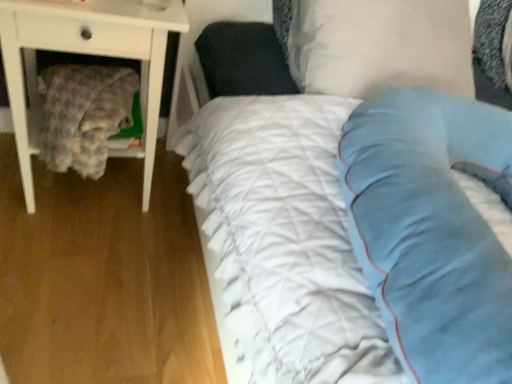
Question: Is fluffy fabric blanket at left completely or partially inside white quilted fabric at center?

Choices:
 (A) no
 (B) yes

Answer: (A)

Question: From the image's perspective, is white quilted fabric at center on top of fluffy fabric blanket at left?

Choices:
 (A) yes
 (B) no

Answer: (B)

Question: Is white quilted fabric at center aimed at fluffy fabric blanket at left?

Choices:
 (A) yes
 (B) no

Answer: (B)

Question: Considering the relative sizes of white quilted fabric at center and fluffy fabric blanket at left in the image provided, is white quilted fabric at center wider than fluffy fabric blanket at left?

Choices:
 (A) no
 (B) yes

Answer: (B)

Question: Can you confirm if white quilted fabric at center is taller than fluffy fabric blanket at left?

Choices:
 (A) yes
 (B) no

Answer: (B)

Question: Can you confirm if white quilted fabric at center is bigger than fluffy fabric blanket at left?

Choices:
 (A) yes
 (B) no

Answer: (A)

Question: Does white wood nightstand at left have a smaller size compared to white soft pillow at upper center?

Choices:
 (A) no
 (B) yes

Answer: (A)

Question: Can you confirm if white wood nightstand at left is wider than white soft pillow at upper center?

Choices:
 (A) yes
 (B) no

Answer: (A)

Question: Is white wood nightstand at left oriented towards white soft pillow at upper center?

Choices:
 (A) yes
 (B) no

Answer: (B)

Question: Is white wood nightstand at left to the left of white soft pillow at upper center from the viewer's perspective?

Choices:
 (A) no
 (B) yes

Answer: (B)

Question: Is white wood nightstand at left looking in the opposite direction of white soft pillow at upper center?

Choices:
 (A) yes
 (B) no

Answer: (B)

Question: Is there a large distance between white wood nightstand at left and white soft pillow at upper center?

Choices:
 (A) yes
 (B) no

Answer: (B)

Question: Is white wood nightstand at left with fluffy fabric blanket at left?

Choices:
 (A) no
 (B) yes

Answer: (A)